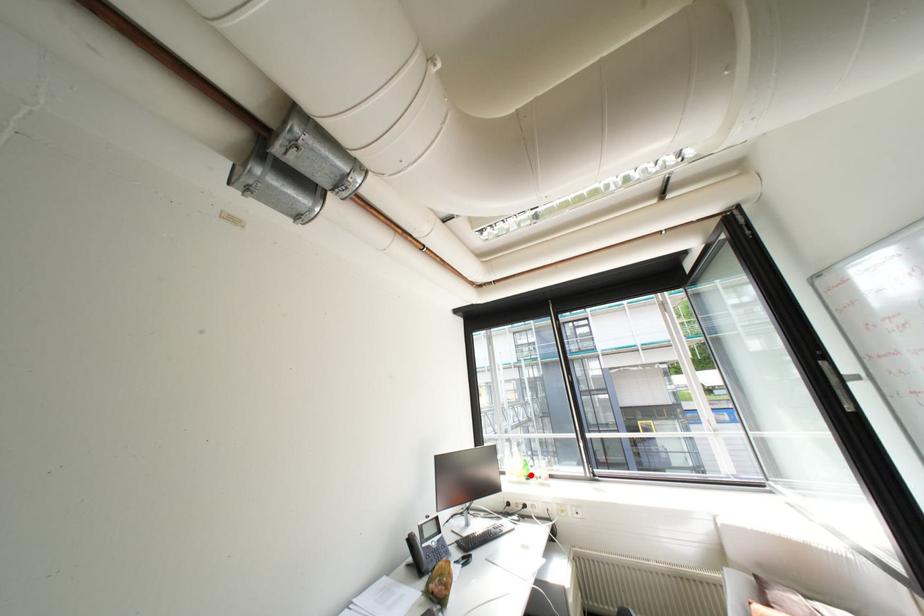
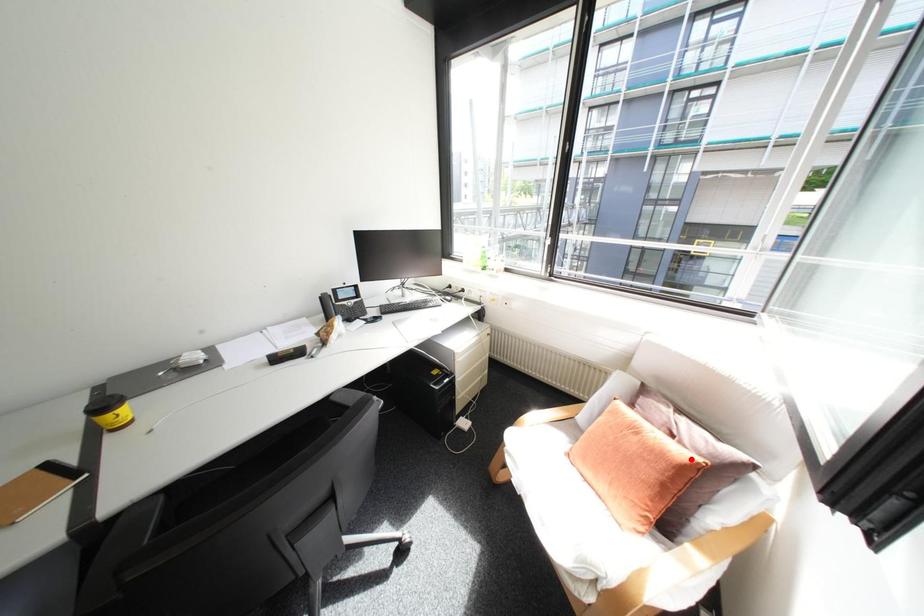
I am providing you with two images of the same scene from different viewpoints. A red point is marked on the first image and another point is marked on the second image. Is the marked point in image1 the same physical position as the marked point in image2?

No